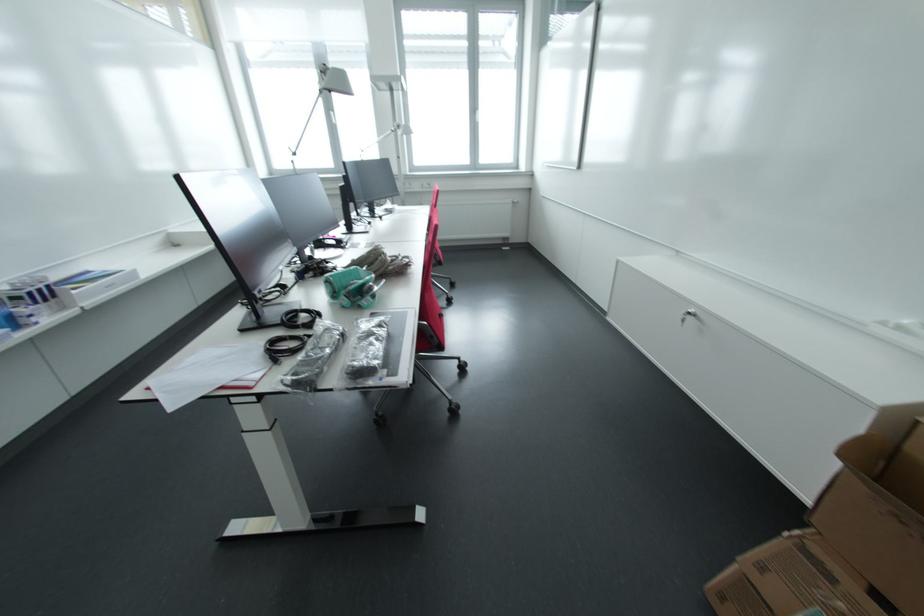
Identify the location of key in cabinet lock. This screenshot has width=924, height=616. (687, 315).